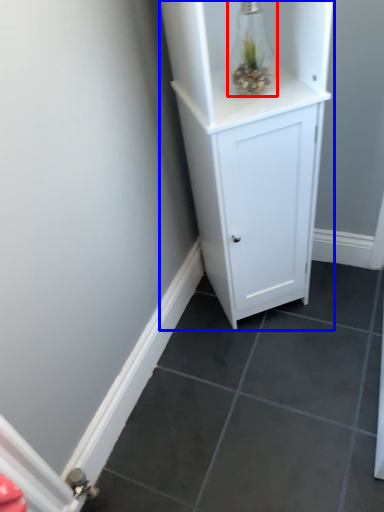
Question: Which point is further to the camera, glass vase (highlighted by a red box) or cupboard (highlighted by a blue box)?

Choices:
 (A) glass vase
 (B) cupboard

Answer: (A)